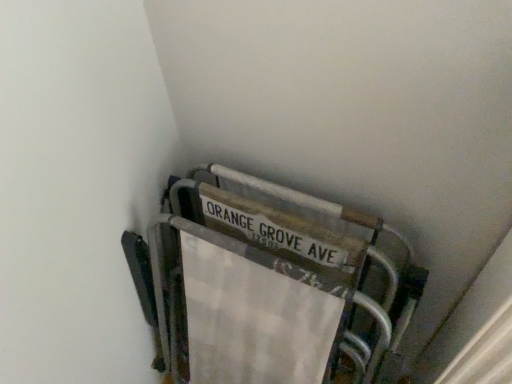
Describe the element at coordinates (266, 289) in the screenshot. I see `metallic silver folding chair at center` at that location.

Measure the distance between metallic silver folding chair at center and camera.

65.87 centimeters.

At what (x,y) coordinates should I click in order to perform the action: click on metallic silver folding chair at center. Please return your answer as a coordinate pair (x, y). Image resolution: width=512 pixels, height=384 pixels. Looking at the image, I should click on (266, 289).

What is the approximate height of metallic silver folding chair at center?

The height of metallic silver folding chair at center is 31.50 inches.

Identify the location of metallic silver folding chair at center. (266, 289).